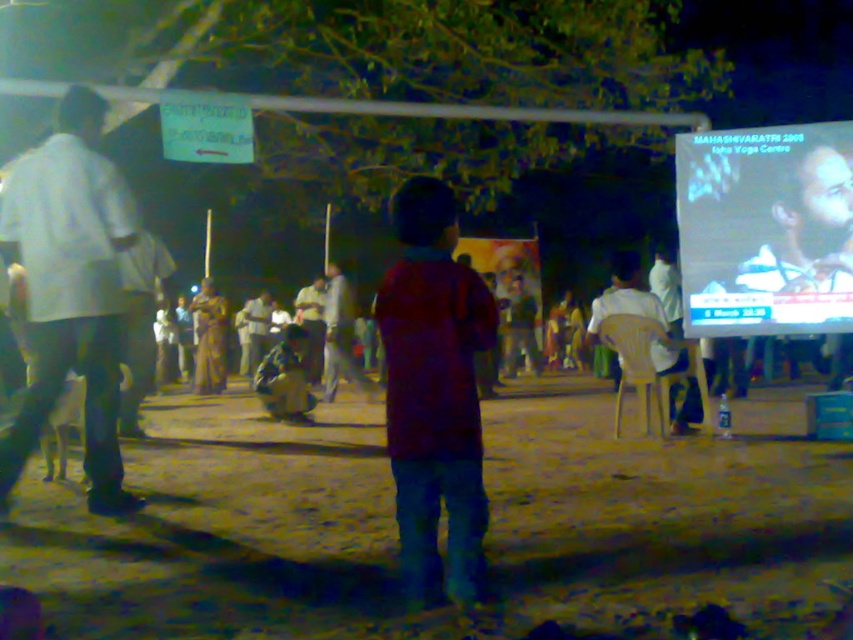
You are at a nighttime outdoor event and see the white cotton shirt at left and the white plastic chair at center. Which object takes up more space in the image?

The white cotton shirt at left is larger in size than the white plastic chair at center, so it takes up more space in the image.